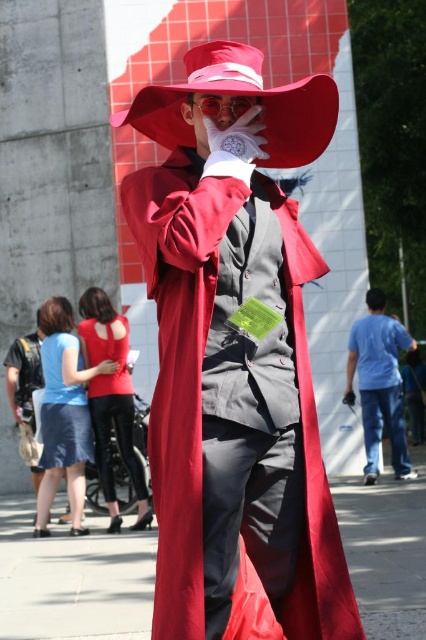
Does matte red cape at center have a greater height compared to matte black suit at center?

No.

Who is lower down, matte red cape at center or matte black suit at center?

Positioned lower is matte red cape at center.

The height and width of the screenshot is (640, 426). What are the coordinates of `matte red cape at center` in the screenshot? It's located at (236, 360).

Between matte red cowboy hat at center and blue cotton shirt at right, which one has more height?

Standing taller between the two is matte red cowboy hat at center.

Is matte red cowboy hat at center to the right of blue cotton shirt at right from the viewer's perspective?

In fact, matte red cowboy hat at center is to the left of blue cotton shirt at right.

Between point (242, 81) and point (374, 358), which one is positioned behind?

Point (374, 358)

Identify the location of matte red cowboy hat at center. (241, 100).

Can you confirm if matte red cowboy hat at center is smaller than matte black suit at center?

Actually, matte red cowboy hat at center might be larger than matte black suit at center.

Does point (238, 93) come behind point (14, 371)?

That is False.

Locate an element on the screen. The height and width of the screenshot is (640, 426). matte red cowboy hat at center is located at coordinates pos(241,100).